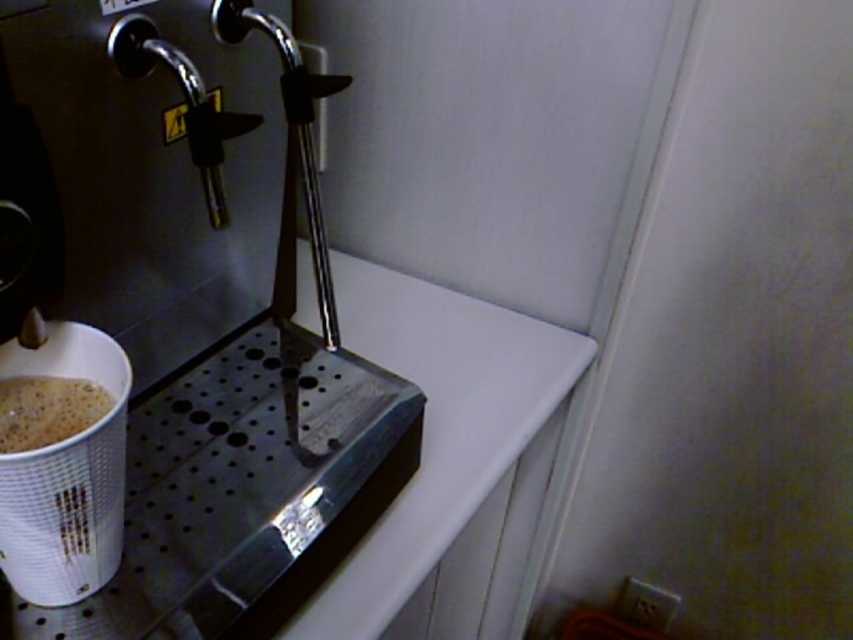
Question: Where is metallic silver coffee machine at left located in relation to foamy white coffee at lower left in the image?

Choices:
 (A) above
 (B) below

Answer: (A)

Question: Among these points, which one is farthest from the camera?

Choices:
 (A) (10, 429)
 (B) (80, 186)

Answer: (B)

Question: Which object is positioned farthest from the foamy white coffee at lower left?

Choices:
 (A) white paper cup at lower left
 (B) metallic silver coffee machine at left

Answer: (B)

Question: Which object is closer to the camera taking this photo?

Choices:
 (A) metallic silver coffee machine at left
 (B) foamy white coffee at lower left

Answer: (A)

Question: Where is white paper cup at lower left located in relation to foamy white coffee at lower left in the image?

Choices:
 (A) below
 (B) above

Answer: (A)

Question: Does metallic silver coffee machine at left have a smaller size compared to foamy white coffee at lower left?

Choices:
 (A) no
 (B) yes

Answer: (A)